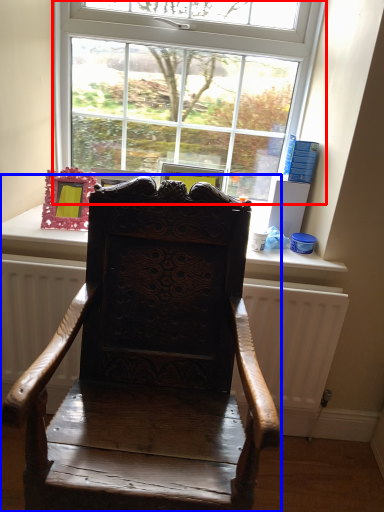
Question: Which of the following is the closest to the observer, window (highlighted by a red box) or chair (highlighted by a blue box)?

Choices:
 (A) window
 (B) chair

Answer: (B)